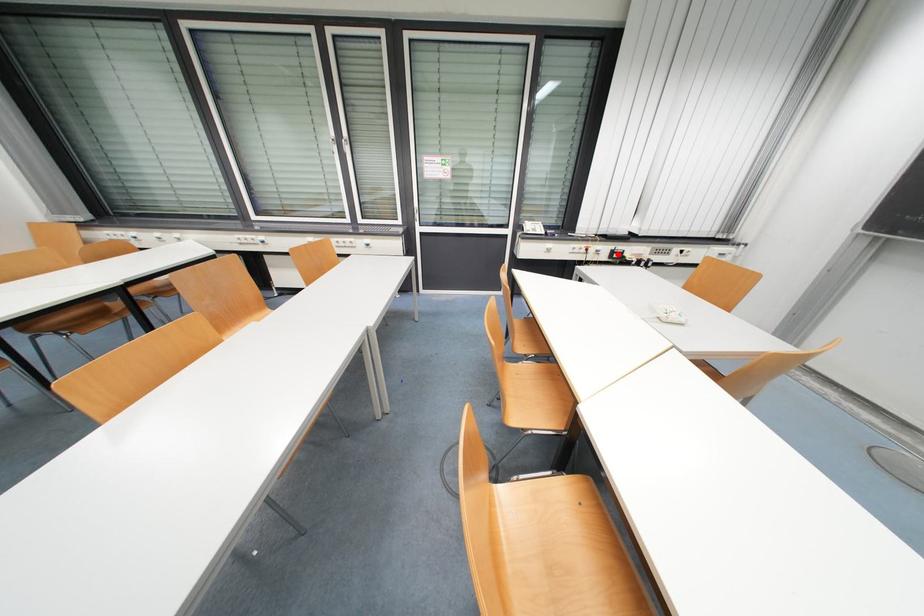
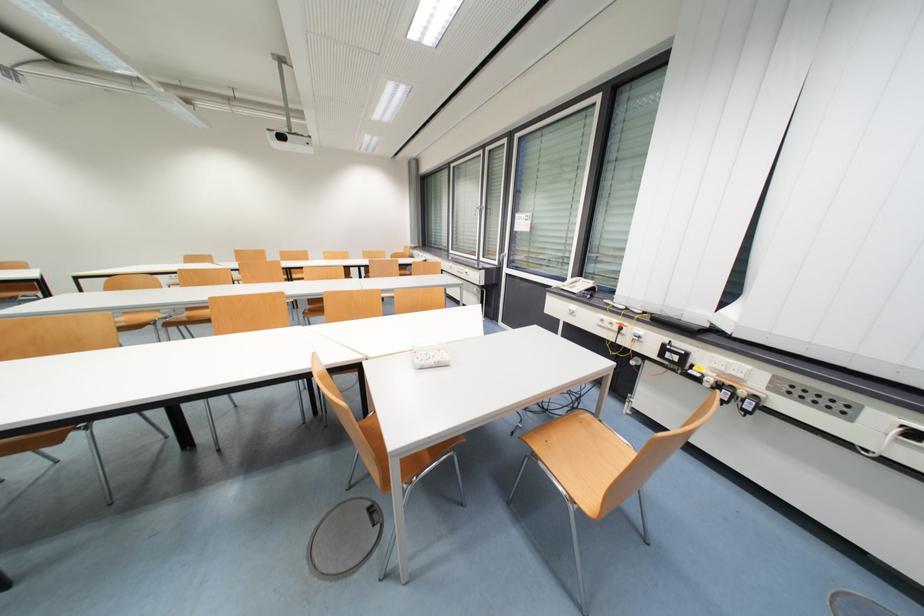
Question: I am providing you with two images of the same scene from different viewpoints. A red point is marked on the first image. At the location where the point appears in image 1, is it still visible in image 2?

Choices:
 (A) Yes
 (B) No

Answer: (A)